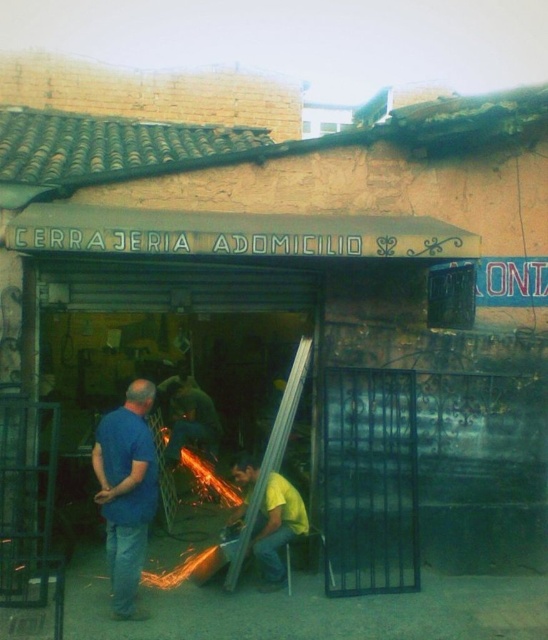
In the scene shown: You are standing at point (128,468) and want to enter the shop. The shop entrance is at point 0.234, 0.733. Can you walk directly to the entrance without crossing any obstacles?

The distance between point (128,468) and the entrance at point 0.234, 0.733 is 5.57 meters. Since there are no obstacles mentioned in the scene description, you can walk directly to the entrance.

You are a customer entering the shop and need to ask both the blue matte shirt at center and the yellow matte shirt at center for assistance. Which worker should you approach first if you want to speak to the one closer to the entrance?

The blue matte shirt at center is positioned on the left side of yellow matte shirt at center, so the blue matte shirt at center is closer to the entrance. Approach the blue matte shirt at center first.